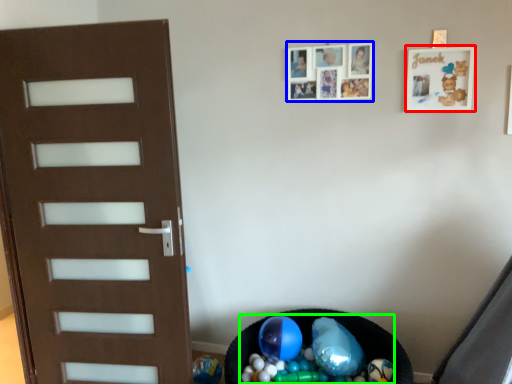
Question: Which object is the closest to the picture frame (highlighted by a red box)? Choose among these: picture frame (highlighted by a blue box) or garbage (highlighted by a green box).

Choices:
 (A) picture frame
 (B) garbage

Answer: (A)